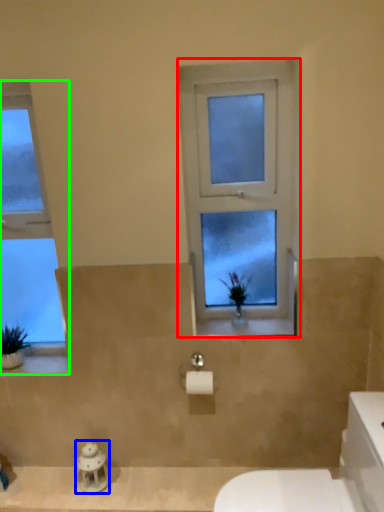
Question: Based on their relative distances, which object is farther from window (highlighted by a red box)? Choose from figurine (highlighted by a blue box) and window (highlighted by a green box).

Choices:
 (A) figurine
 (B) window

Answer: (A)